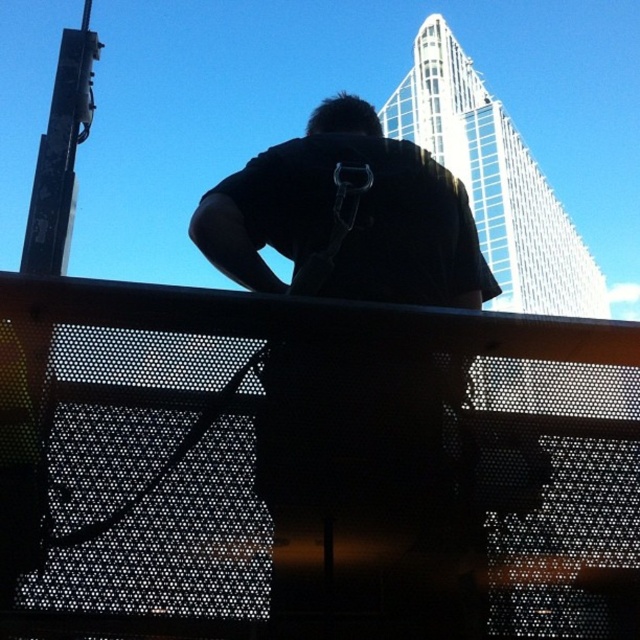
Is perforated metal fence at center to the left of black matte shirt at center from the viewer's perspective?

Correct, you'll find perforated metal fence at center to the left of black matte shirt at center.

Looking at this image, who is more forward, (515, 394) or (301, 445)?

Positioned in front is point (301, 445).

Locate an element on the screen. The height and width of the screenshot is (640, 640). perforated metal fence at center is located at coordinates (310, 467).